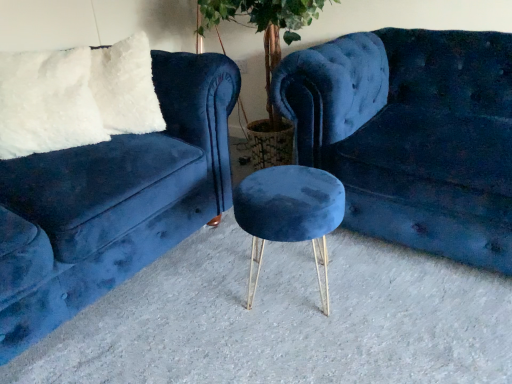
Identify the location of free space between velvet blue stool at center and velvet blue couch at center, arranged as the first studio couch when viewed from the right. Image resolution: width=512 pixels, height=384 pixels. (376, 290).